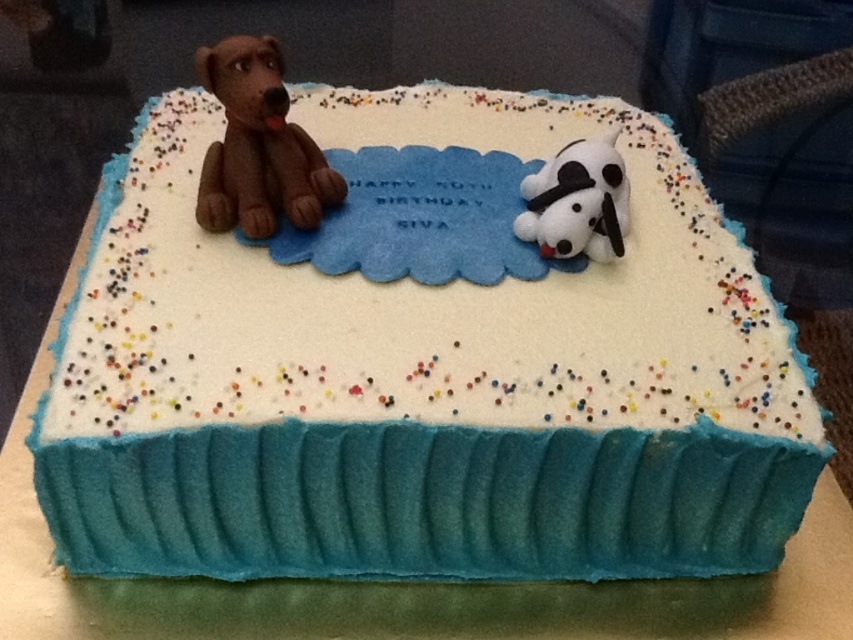
Does matte chocolate teddy bear at left appear under white plush dog at upper right?

Actually, matte chocolate teddy bear at left is above white plush dog at upper right.

Which is above, matte chocolate teddy bear at left or white plush dog at upper right?

Positioned higher is matte chocolate teddy bear at left.

The width and height of the screenshot is (853, 640). Describe the element at coordinates (258, 147) in the screenshot. I see `matte chocolate teddy bear at left` at that location.

The height and width of the screenshot is (640, 853). In order to click on matte chocolate teddy bear at left in this screenshot , I will do `click(258, 147)`.